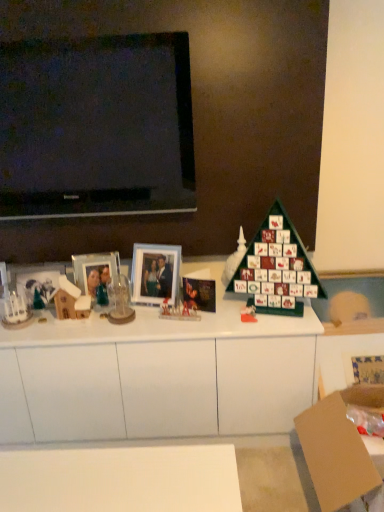
Question: From a real-world perspective, is matte glass picture frame at left, the second picture frame in the right-to-left sequence, positioned under wooden house at left, which ranks as the fourth toy in right-to-left order, based on gravity?

Choices:
 (A) no
 (B) yes

Answer: (A)

Question: Are matte glass picture frame at left, the second picture frame in the right-to-left sequence, and wooden house at left, acting as the first toy starting from the left, located far from each other?

Choices:
 (A) no
 (B) yes

Answer: (A)

Question: Is matte glass picture frame at left, the second picture frame in the right-to-left sequence, to the right of wooden house at left, which ranks as the fourth toy in right-to-left order, from the viewer's perspective?

Choices:
 (A) no
 (B) yes

Answer: (B)

Question: Can you confirm if matte glass picture frame at left, the second picture frame in the right-to-left sequence, is thinner than wooden house at left, acting as the first toy starting from the left?

Choices:
 (A) no
 (B) yes

Answer: (B)

Question: Considering the relative sizes of matte glass picture frame at left, arranged as the first picture frame when viewed from the left, and wooden house at left, acting as the first toy starting from the left, in the image provided, is matte glass picture frame at left, arranged as the first picture frame when viewed from the left, wider than wooden house at left, acting as the first toy starting from the left,?

Choices:
 (A) no
 (B) yes

Answer: (A)

Question: From the image's perspective, is matte glass picture frame at left, the second picture frame in the right-to-left sequence, above wooden house at left, acting as the first toy starting from the left?

Choices:
 (A) yes
 (B) no

Answer: (A)

Question: Is glossy paper christmas card at center looking in the opposite direction of brown cardboard box at lower right?

Choices:
 (A) yes
 (B) no

Answer: (B)

Question: Is glossy paper christmas card at center further to the viewer compared to brown cardboard box at lower right?

Choices:
 (A) yes
 (B) no

Answer: (A)

Question: Is glossy paper christmas card at center at the left side of brown cardboard box at lower right?

Choices:
 (A) no
 (B) yes

Answer: (B)

Question: Would you say glossy paper christmas card at center is outside brown cardboard box at lower right?

Choices:
 (A) yes
 (B) no

Answer: (A)

Question: Is glossy paper christmas card at center facing towards brown cardboard box at lower right?

Choices:
 (A) yes
 (B) no

Answer: (B)

Question: From a real-world perspective, is glossy paper christmas card at center positioned under brown cardboard box at lower right based on gravity?

Choices:
 (A) yes
 (B) no

Answer: (B)

Question: From a real-world perspective, is green matte advent calendar at center, which is the first toy from right to left, physically below glossy paper christmas card at center?

Choices:
 (A) yes
 (B) no

Answer: (A)